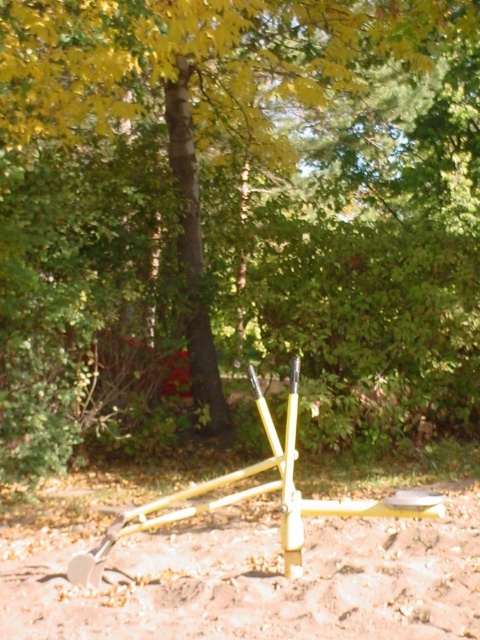
Question: Is green matte tree at center smaller than yellow metallic tool at center?

Choices:
 (A) no
 (B) yes

Answer: (B)

Question: Can you confirm if yellow matte shovel at center is positioned above yellow metallic tool at center?

Choices:
 (A) no
 (B) yes

Answer: (A)

Question: Is green matte tree at center above yellow matte shovel at center?

Choices:
 (A) no
 (B) yes

Answer: (B)

Question: Estimate the real-world distances between objects in this image. Which object is farther from the yellow matte shovel at center?

Choices:
 (A) yellow metallic tool at center
 (B) green matte tree at center

Answer: (B)

Question: Based on their relative distances, which object is farther from the green matte tree at center?

Choices:
 (A) yellow metallic tool at center
 (B) yellow matte shovel at center

Answer: (B)

Question: Which of the following is the farthest from the observer?

Choices:
 (A) yellow matte shovel at center
 (B) yellow metallic tool at center

Answer: (B)